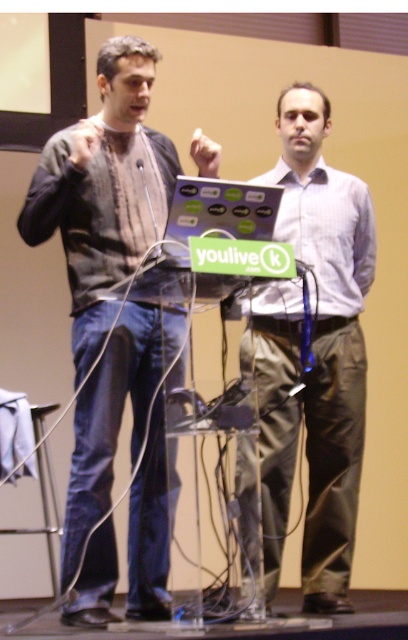
Which of these two, matte gray sweater at left or white glossy shirt at center, stands taller?

white glossy shirt at center is taller.

Is point (97, 276) closer to viewer compared to point (370, 234)?

Yes, it is in front of point (370, 234).

You are a GUI agent. You are given a task and a screenshot of the screen. Output one action in this format:
    pyautogui.click(x=<x>, y=<y>)
    Task: Click on the matte gray sweater at left
    The image size is (408, 640).
    Given the screenshot: What is the action you would take?
    pyautogui.click(x=104, y=192)

Is matte gray sweater at left closer to the viewer compared to matte black laptop at center?

No.

Does matte gray sweater at left appear under matte black laptop at center?

Indeed, matte gray sweater at left is positioned under matte black laptop at center.

What do you see at coordinates (104, 192) in the screenshot?
I see `matte gray sweater at left` at bounding box center [104, 192].

Where is `matte gray sweater at left`? The width and height of the screenshot is (408, 640). matte gray sweater at left is located at coordinates (104, 192).

Who is more distant from viewer, (290, 188) or (246, 189)?

Positioned behind is point (290, 188).

Does white glossy shirt at center have a smaller size compared to matte black laptop at center?

No, white glossy shirt at center is not smaller than matte black laptop at center.

The width and height of the screenshot is (408, 640). In order to click on white glossy shirt at center in this screenshot , I will do `click(314, 355)`.

You are a GUI agent. You are given a task and a screenshot of the screen. Output one action in this format:
    pyautogui.click(x=<x>, y=<y>)
    Task: Click on the white glossy shirt at center
    This screenshot has width=408, height=640.
    Given the screenshot: What is the action you would take?
    pyautogui.click(x=314, y=355)